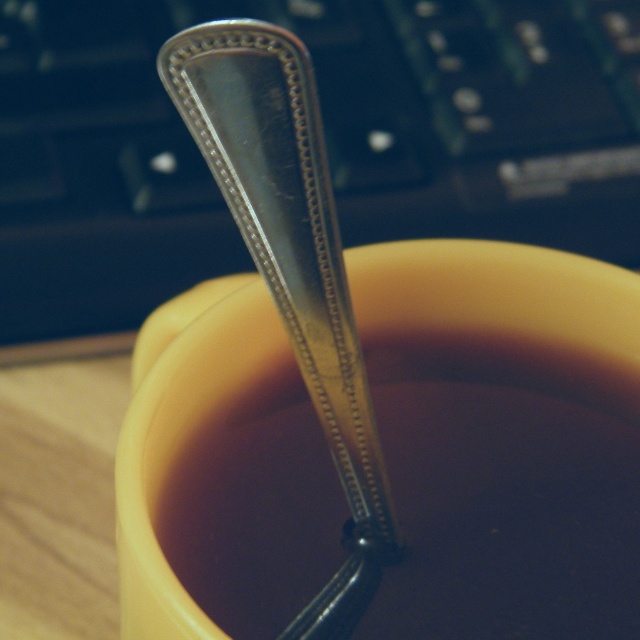
Question: In this image, where is black plastic keyboard at upper center located relative to shiny metallic spoon at center?

Choices:
 (A) left
 (B) right

Answer: (A)

Question: Among these objects, which one is farthest from the camera?

Choices:
 (A) polished silver spoon at center
 (B) shiny metallic spoon at center
 (C) black plastic keyboard at upper center

Answer: (C)

Question: Is black plastic keyboard at upper center above polished silver spoon at center?

Choices:
 (A) no
 (B) yes

Answer: (B)

Question: Which of these objects is positioned closest to the shiny metallic spoon at center?

Choices:
 (A) polished silver spoon at center
 (B) black plastic keyboard at upper center

Answer: (A)

Question: Among these points, which one is farthest from the camera?

Choices:
 (A) (339, 424)
 (B) (77, 145)
 (C) (550, 525)

Answer: (B)

Question: Is shiny metallic spoon at center further to the viewer compared to polished silver spoon at center?

Choices:
 (A) no
 (B) yes

Answer: (B)